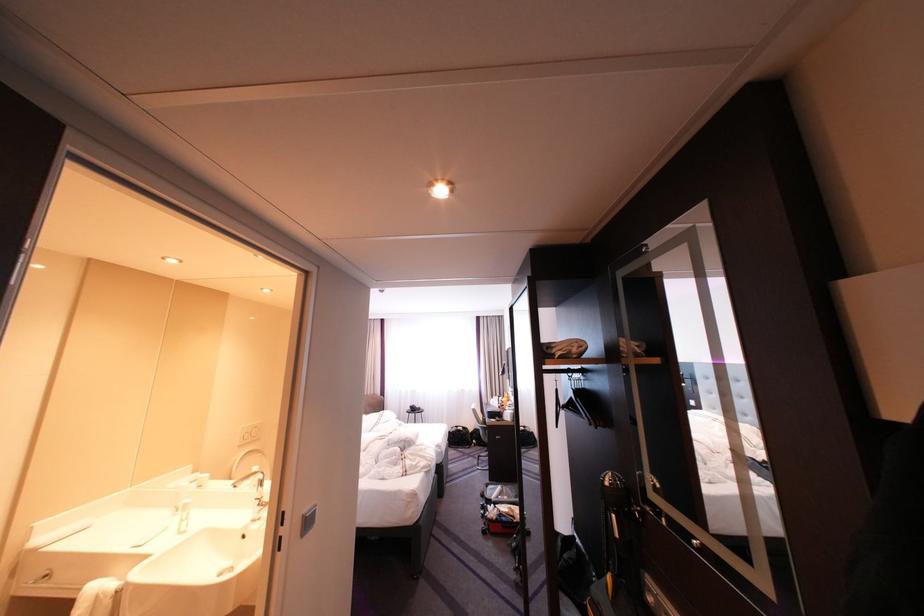
Find where to push the grey light switch. Please return your answer as a coordinate pair (x, y).

(308, 521)